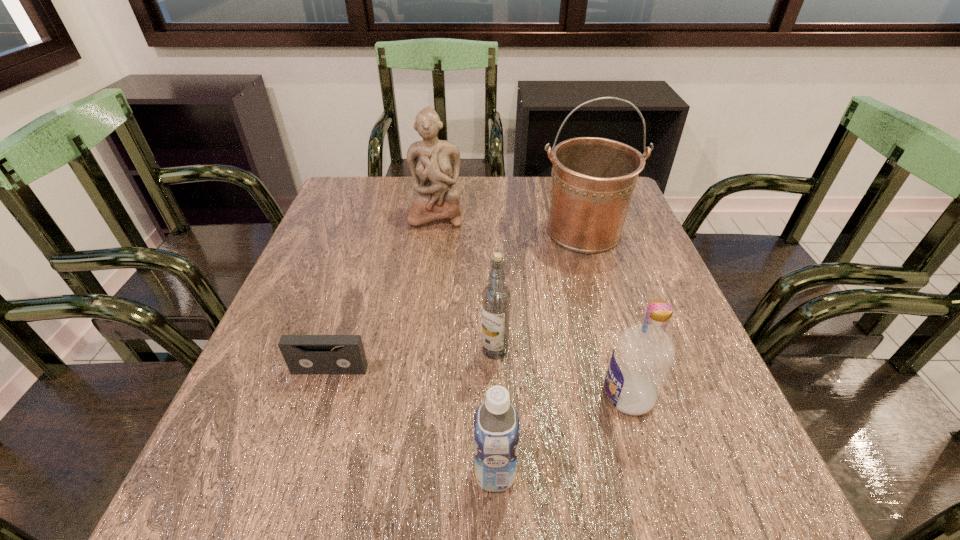
I want to click on vacant space located 0.280m on the label of the soya milk, so click(x=293, y=473).

Find the location of a particular element. This screenshot has width=960, height=540. free space located 0.050m on the front-facing side of the videotape is located at coordinates (321, 398).

You are a GUI agent. You are given a task and a screenshot of the screen. Output one action in this format:
    pyautogui.click(x=<x>, y=<y>)
    Task: Click on the bucket that is at the far edge
    This screenshot has width=960, height=540.
    Given the screenshot: What is the action you would take?
    593,179

The image size is (960, 540). I want to click on figurine that is at the far edge, so pos(434,164).

Locate an element on the screen. The image size is (960, 540). object at the near edge is located at coordinates (496, 422).

Find the location of a particular element. object at the left edge is located at coordinates (304, 354).

Find the location of a particular element. bucket that is at the right edge is located at coordinates (593, 179).

At what (x,y) coordinates should I click in order to perform the action: click on vodka that is at the right edge. Please return your answer as a coordinate pair (x, y). Looking at the image, I should click on (642, 358).

Where is `object positioned at the far right corner`? object positioned at the far right corner is located at coordinates (593, 179).

Find the location of a particular element. Image resolution: width=960 pixels, height=540 pixels. free space at the near edge is located at coordinates (613, 501).